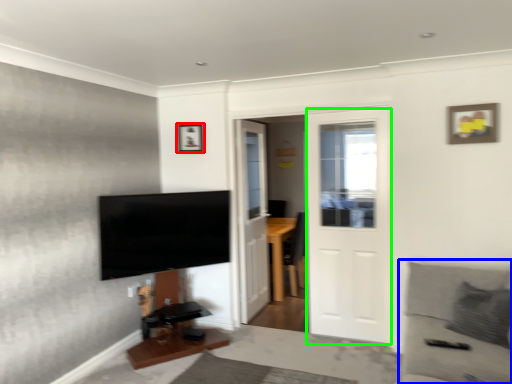
Question: Which object is positioned closest to picture frame (highlighted by a red box)? Select from couch (highlighted by a blue box) and door (highlighted by a green box).

Choices:
 (A) couch
 (B) door

Answer: (B)